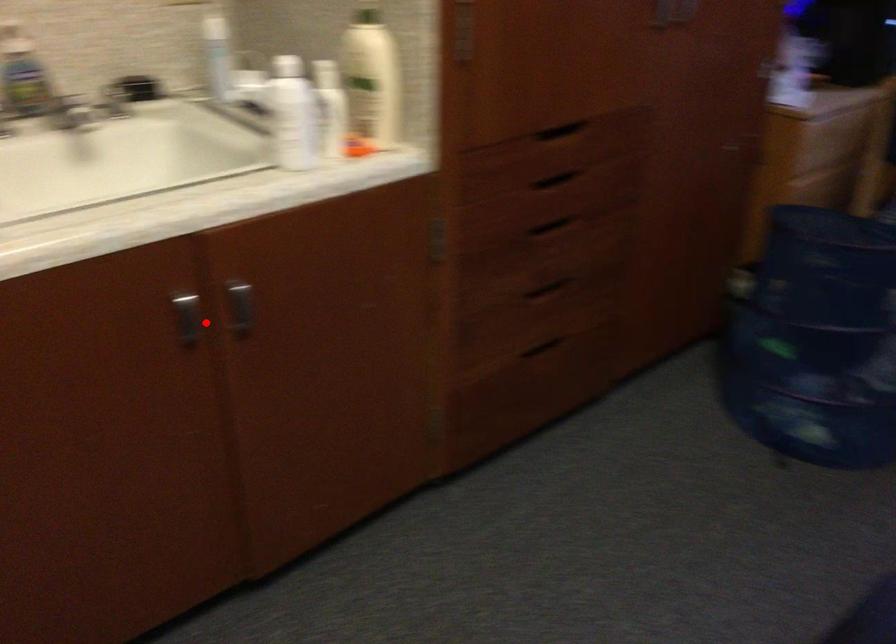
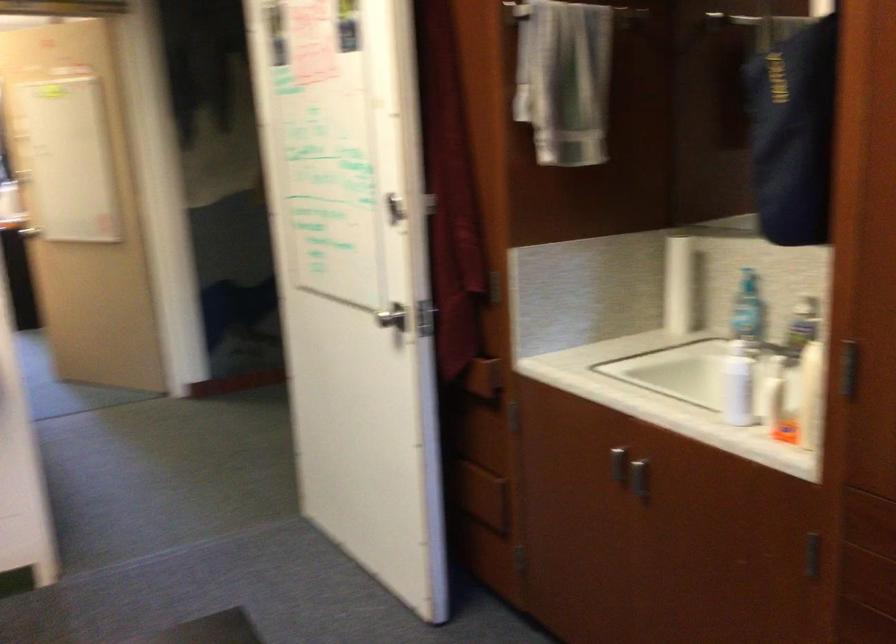
Question: I am providing you with two images of the same scene from different viewpoints. In image1, a red point is highlighted. Considering the same 3D point in image2, which of the following is correct?

Choices:
 (A) It is closer
 (B) It is farther

Answer: (B)